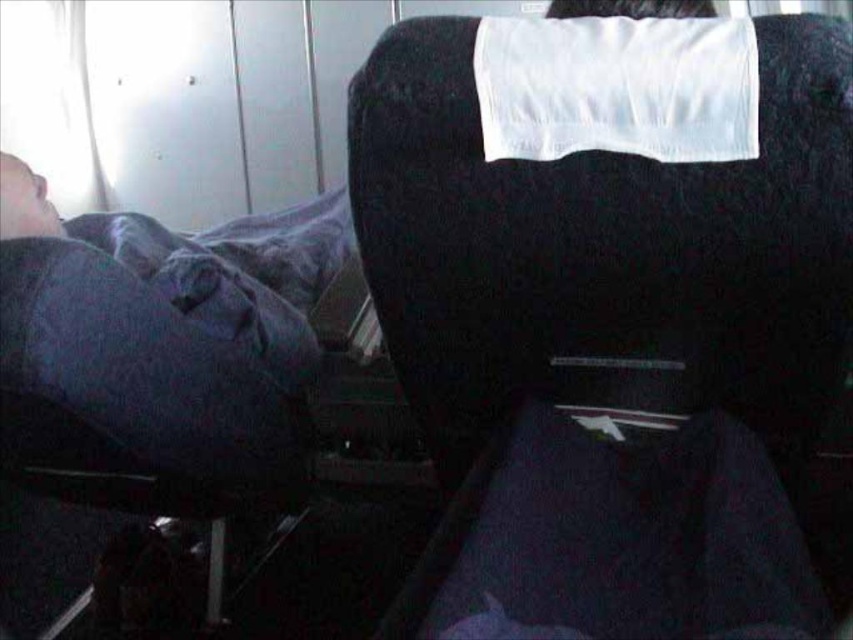
You are a passenger on a train and need to choose between sitting on the black fabric chair at upper right or the dark blue fabric at left. Which seat would provide more space?

The black fabric chair at upper right is bigger than the dark blue fabric at left, so it provides more space.